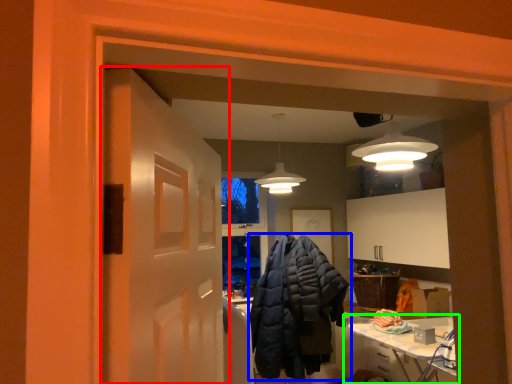
Question: Which object is positioned closest to door (highlighted by a red box)? Select from jacket (highlighted by a blue box) and table (highlighted by a green box).

Choices:
 (A) jacket
 (B) table

Answer: (B)